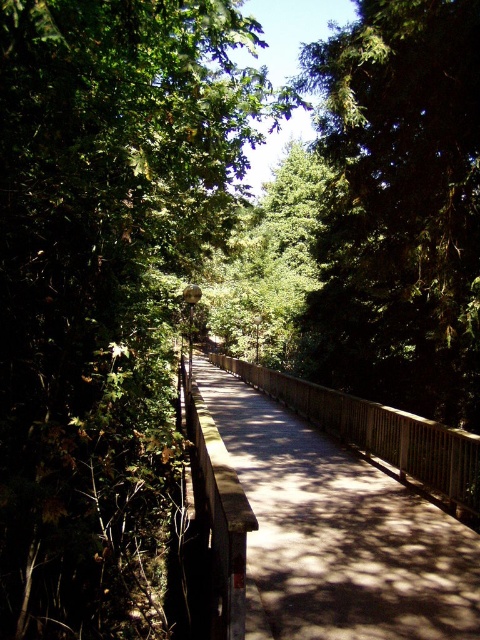
Question: Which point is closer to the camera taking this photo?

Choices:
 (A) (444, 595)
 (B) (127, 346)
 (C) (411, 189)

Answer: (A)

Question: Which object is farther from the camera taking this photo?

Choices:
 (A) green leafy tree at center
 (B) green textured tree at center

Answer: (B)

Question: Which object is the closest to the green leafy tree at center?

Choices:
 (A) green textured tree at center
 (B) wooden bridge at center

Answer: (B)

Question: Is green textured tree at center wider than wooden bridge at center?

Choices:
 (A) no
 (B) yes

Answer: (A)

Question: Observing the image, what is the correct spatial positioning of green textured tree at center in reference to wooden bridge at center?

Choices:
 (A) left
 (B) right

Answer: (B)

Question: Observing the image, what is the correct spatial positioning of green leafy tree at center in reference to green textured tree at center?

Choices:
 (A) right
 (B) left

Answer: (B)